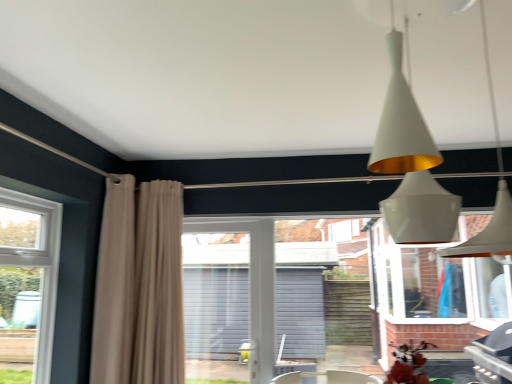
Describe the element at coordinates (410, 162) in the screenshot. I see `white matte cone at upper center` at that location.

Describe the element at coordinates (115, 285) in the screenshot. I see `beige fabric curtain at left, positioned as the first curtain in left-to-right order` at that location.

Locate an element on the screen. beige fabric curtain at left, positioned as the first curtain in left-to-right order is located at coordinates (115, 285).

This screenshot has width=512, height=384. What do you see at coordinates (139, 285) in the screenshot?
I see `beige fabric curtain at left, placed as the 2th curtain when sorted from left to right` at bounding box center [139, 285].

Identify the location of white plastic screen door at center. The image size is (512, 384). (254, 288).

Measure the distance between point [233,224] and camera.

The distance of point [233,224] from camera is 3.43 meters.

I want to click on white matte cone at upper center, so click(410, 162).

Can white plastic screen door at center be found inside beige fabric curtain at left, placed as the 2th curtain when sorted from left to right?

Definitely not — white plastic screen door at center is not inside beige fabric curtain at left, placed as the 2th curtain when sorted from left to right.

Visually, is beige fabric curtain at left, which appears as the first curtain when viewed from the right, positioned to the left or to the right of white plastic screen door at center?

beige fabric curtain at left, which appears as the first curtain when viewed from the right, is positioned on white plastic screen door at center's left side.

Would you consider beige fabric curtain at left, placed as the 2th curtain when sorted from left to right, to be distant from white plastic screen door at center?

No, beige fabric curtain at left, placed as the 2th curtain when sorted from left to right, is not far away from white plastic screen door at center.

Is beige fabric curtain at left, which appears as the first curtain when viewed from the right, oriented towards white plastic screen door at center?

No, beige fabric curtain at left, which appears as the first curtain when viewed from the right, is not oriented towards white plastic screen door at center.

Could you tell me if beige fabric curtain at left, which ranks as the second curtain in right-to-left order, is turned towards brick wall at center?

No, beige fabric curtain at left, which ranks as the second curtain in right-to-left order, is not aimed at brick wall at center.

From the image's perspective, is beige fabric curtain at left, positioned as the first curtain in left-to-right order, on brick wall at center?

Yes, from the image's perspective, beige fabric curtain at left, positioned as the first curtain in left-to-right order, is on top of brick wall at center.

Is point (109, 380) positioned after point (379, 260)?

Yes, it is behind point (379, 260).

Considering the relative positions of beige fabric curtain at left, placed as the 2th curtain when sorted from left to right, and beige fabric curtain at left, positioned as the first curtain in left-to-right order, in the image provided, is beige fabric curtain at left, placed as the 2th curtain when sorted from left to right, to the left or to the right of beige fabric curtain at left, positioned as the first curtain in left-to-right order,?

beige fabric curtain at left, placed as the 2th curtain when sorted from left to right, is positioned on beige fabric curtain at left, positioned as the first curtain in left-to-right order,'s right side.

Is point (152, 281) positioned before point (102, 236)?

That is False.

Is beige fabric curtain at left, placed as the 2th curtain when sorted from left to right, bigger than beige fabric curtain at left, which ranks as the second curtain in right-to-left order?

Yes, beige fabric curtain at left, placed as the 2th curtain when sorted from left to right, is bigger than beige fabric curtain at left, which ranks as the second curtain in right-to-left order.

Identify the location of curtain below the beige fabric curtain at left, positioned as the first curtain in left-to-right order (from a real-world perspective). (139, 285).

From a real-world perspective, who is located lower, white matte cone at upper center or white plastic screen door at center?

white plastic screen door at center, from a real-world perspective.

Could you tell me if white matte cone at upper center is facing white plastic screen door at center?

No, white matte cone at upper center is not oriented towards white plastic screen door at center.

From the image's perspective, which one is positioned higher, white matte cone at upper center or white plastic screen door at center?

white matte cone at upper center appears higher in the image.

Is white plastic screen door at center inside white matte cone at upper center?

No.

The width and height of the screenshot is (512, 384). Identify the location of curtain above the beige fabric curtain at left, which appears as the first curtain when viewed from the right (from a real-world perspective). (115, 285).

Is beige fabric curtain at left, placed as the 2th curtain when sorted from left to right, inside beige fabric curtain at left, which ranks as the second curtain in right-to-left order?

Definitely not — beige fabric curtain at left, placed as the 2th curtain when sorted from left to right, is not inside beige fabric curtain at left, which ranks as the second curtain in right-to-left order.

Which is behind, point (100, 276) or point (178, 202)?

The point (178, 202) is farther from the camera.

Between white plastic screen door at center and brick wall at center, which one is positioned in front?

brick wall at center.

Considering the relative positions of white plastic screen door at center and brick wall at center in the image provided, is white plastic screen door at center to the left or to the right of brick wall at center?

Based on their positions, white plastic screen door at center is located to the left of brick wall at center.

Does white plastic screen door at center have a smaller size compared to brick wall at center?

Yes.

From a real-world perspective, is white plastic screen door at center over brick wall at center?

No, from a real-world perspective, white plastic screen door at center is not on top of brick wall at center.

Does white plastic screen door at center have a lesser width compared to beige fabric curtain at left, positioned as the first curtain in left-to-right order?

Correct, the width of white plastic screen door at center is less than that of beige fabric curtain at left, positioned as the first curtain in left-to-right order.

Are white plastic screen door at center and beige fabric curtain at left, positioned as the first curtain in left-to-right order, far apart?

No, white plastic screen door at center is not far from beige fabric curtain at left, positioned as the first curtain in left-to-right order.

Which is more to the right, white plastic screen door at center or beige fabric curtain at left, which ranks as the second curtain in right-to-left order?

white plastic screen door at center is more to the right.

You are a GUI agent. You are given a task and a screenshot of the screen. Output one action in this format:
    pyautogui.click(x=<x>, y=<y>)
    Task: Click on the curtain that is the 1st one when counting upward from the white plastic screen door at center (from the image's perspective)
    The height and width of the screenshot is (384, 512).
    Given the screenshot: What is the action you would take?
    pyautogui.click(x=139, y=285)

From the brick wall at center, count the 2nd curtain to the left and point to it. Please provide its 2D coordinates.

[(115, 285)]

Looking at the image, which one is located further to white plastic screen door at center, brick wall at center or white matte cone at upper center?

Among the two, white matte cone at upper center is located further to white plastic screen door at center.

Based on their spatial positions, is beige fabric curtain at left, positioned as the first curtain in left-to-right order, or beige fabric curtain at left, which appears as the first curtain when viewed from the right, further from white plastic screen door at center?

beige fabric curtain at left, positioned as the first curtain in left-to-right order, is further to white plastic screen door at center.

Looking at the image, which one is located further to white plastic screen door at center, white matte cone at upper center or beige fabric curtain at left, which ranks as the second curtain in right-to-left order?

white matte cone at upper center is further to white plastic screen door at center.

From the image, which object appears to be nearer to brick wall at center, white plastic screen door at center or beige fabric curtain at left, positioned as the first curtain in left-to-right order?

The object closer to brick wall at center is white plastic screen door at center.

From the image, which object appears to be farther from brick wall at center, white plastic screen door at center or white matte cone at upper center?

white matte cone at upper center lies further to brick wall at center than the other object.

From the image, which object appears to be nearer to beige fabric curtain at left, which ranks as the second curtain in right-to-left order, brick wall at center or white plastic screen door at center?

white plastic screen door at center.

Which object lies further to the anchor point white plastic screen door at center, brick wall at center or beige fabric curtain at left, which appears as the first curtain when viewed from the right?

brick wall at center lies further to white plastic screen door at center than the other object.

Looking at this image, from the image, which object appears to be nearer to beige fabric curtain at left, which appears as the first curtain when viewed from the right, beige fabric curtain at left, positioned as the first curtain in left-to-right order, or brick wall at center?

The object closer to beige fabric curtain at left, which appears as the first curtain when viewed from the right, is beige fabric curtain at left, positioned as the first curtain in left-to-right order.

Find the location of a particular element. This screenshot has width=512, height=384. curtain between beige fabric curtain at left, which ranks as the second curtain in right-to-left order, and brick wall at center from left to right is located at coordinates (139, 285).

At what (x,y) coordinates should I click in order to perform the action: click on screen door located between beige fabric curtain at left, placed as the 2th curtain when sorted from left to right, and brick wall at center in the left-right direction. Please return your answer as a coordinate pair (x, y). The height and width of the screenshot is (384, 512). Looking at the image, I should click on (254, 288).

Find the location of a particular element. This screenshot has width=512, height=384. curtain between white matte cone at upper center and beige fabric curtain at left, placed as the 2th curtain when sorted from left to right, along the z-axis is located at coordinates [115, 285].

The image size is (512, 384). Find the location of `backyard positioned between white matte cone at upper center and white plastic screen door at center from near to far`. backyard positioned between white matte cone at upper center and white plastic screen door at center from near to far is located at coordinates (269, 290).